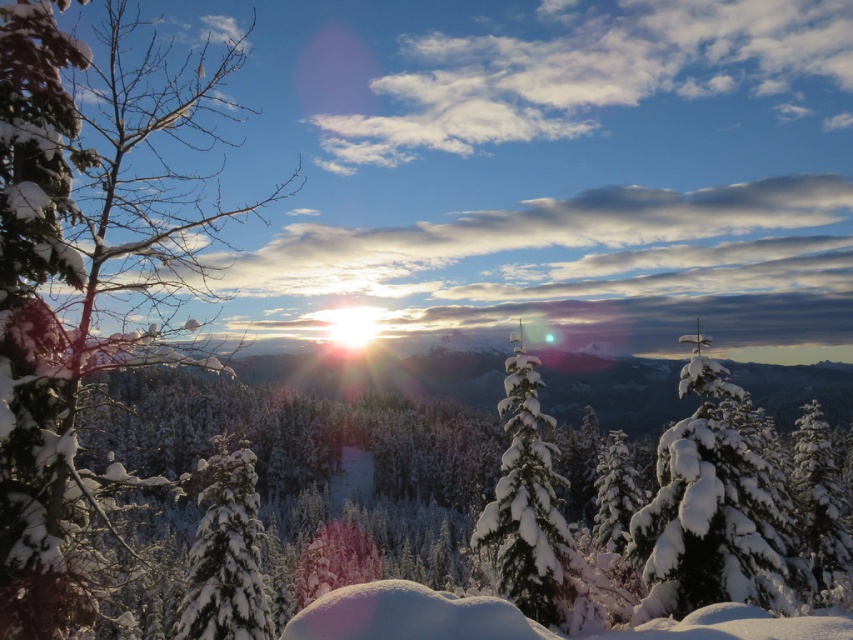
Question: Is snow-covered branch at left positioned before snow-covered evergreen at center?

Choices:
 (A) no
 (B) yes

Answer: (B)

Question: Does snow-covered evergreen at right have a larger size compared to snow-covered evergreen at center?

Choices:
 (A) yes
 (B) no

Answer: (B)

Question: Is snow-covered evergreen at right below white fluffy snow-covered tree at center?

Choices:
 (A) yes
 (B) no

Answer: (B)

Question: Which object appears closest to the camera in this image?

Choices:
 (A) snow-covered evergreen at center
 (B) snow-covered evergreen at right

Answer: (B)

Question: Which object appears closest to the camera in this image?

Choices:
 (A) snow-covered evergreen at center
 (B) snow-covered branch at left

Answer: (B)

Question: Estimate the real-world distances between objects in this image. Which object is closer to the snow-covered evergreen at center?

Choices:
 (A) snow-covered evergreen at right
 (B) snow-covered branch at left

Answer: (A)